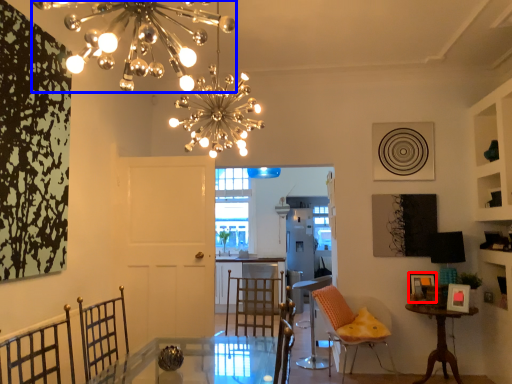
Question: Which object is closer to the camera taking this photo, picture frame (highlighted by a red box) or chandelier (highlighted by a blue box)?

Choices:
 (A) picture frame
 (B) chandelier

Answer: (B)